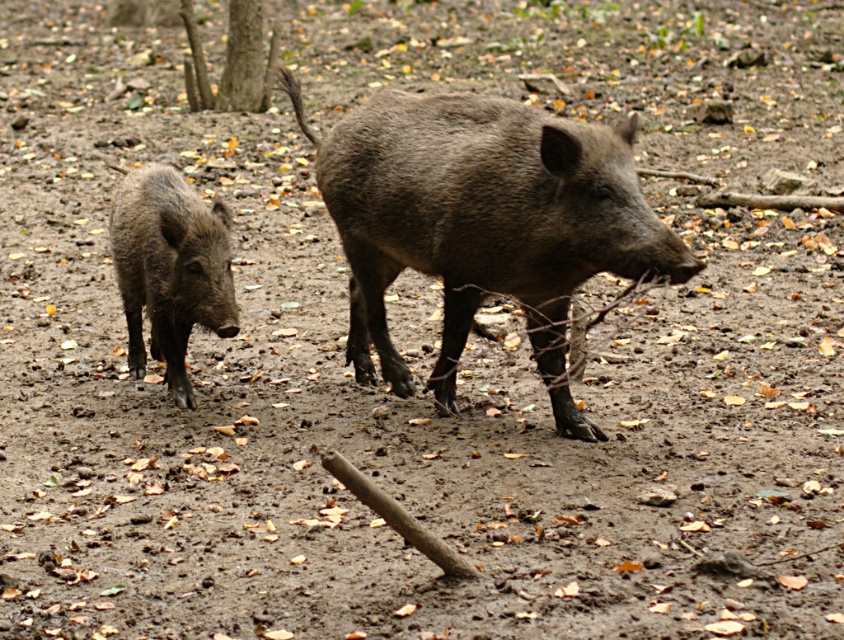
Question: Can you confirm if dark brown textured pig at center is wider than dark brown muddy pig at left?

Choices:
 (A) yes
 (B) no

Answer: (A)

Question: Does dark brown textured pig at center appear under dark brown muddy pig at left?

Choices:
 (A) yes
 (B) no

Answer: (B)

Question: Among these objects, which one is farthest from the camera?

Choices:
 (A) dark brown textured pig at center
 (B) dark brown muddy pig at left

Answer: (B)

Question: Can you confirm if dark brown textured pig at center is bigger than dark brown muddy pig at left?

Choices:
 (A) no
 (B) yes

Answer: (B)

Question: Which point appears closest to the camera in this image?

Choices:
 (A) (214, 257)
 (B) (436, 248)

Answer: (B)

Question: Which of the following is the farthest from the observer?

Choices:
 (A) (181, 380)
 (B) (442, 358)

Answer: (A)